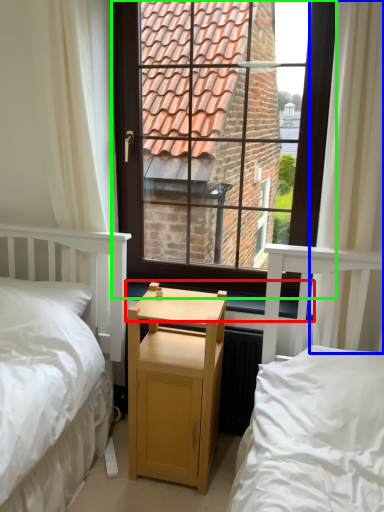
Question: Which object is the closest to the window sill (highlighted by a red box)? Choose among these: curtain (highlighted by a blue box) or window (highlighted by a green box).

Choices:
 (A) curtain
 (B) window

Answer: (A)